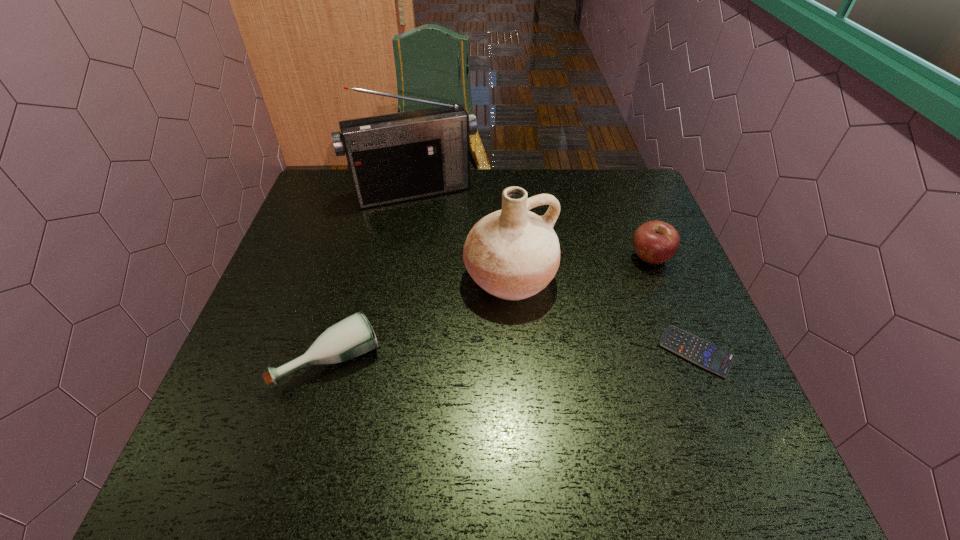
The image size is (960, 540). Identify the location of vacant region at the near right corner. (676, 386).

The image size is (960, 540). I want to click on free area in between the bottle and the pottery, so click(x=420, y=319).

At what (x,y) coordinates should I click in order to perform the action: click on vacant area between the apple and the shortest object. Please return your answer as a coordinate pair (x, y). This screenshot has height=540, width=960. Looking at the image, I should click on (673, 304).

I want to click on unoccupied position between the pottery and the farthest object, so click(462, 235).

Find the location of a particular element. unoccupied position between the apple and the calculator is located at coordinates (673, 304).

This screenshot has width=960, height=540. I want to click on free space between the shortest object and the bottle, so point(514,355).

Locate an element on the screen. This screenshot has height=540, width=960. vacant point located between the bottle and the pottery is located at coordinates (420, 319).

The height and width of the screenshot is (540, 960). Identify the location of free spot between the second tallest object and the apple. (580, 267).

Where is `free spot between the apple and the bottle`? This screenshot has width=960, height=540. free spot between the apple and the bottle is located at coordinates (491, 308).

This screenshot has height=540, width=960. In order to click on vacant space that's between the radio receiver and the pottery in this screenshot , I will do `click(462, 235)`.